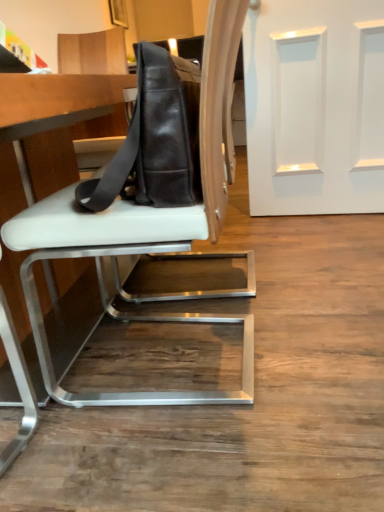
Question: In the image, is white leather table at center on the left side or the right side of white leather chair at center?

Choices:
 (A) right
 (B) left

Answer: (B)

Question: Is white leather table at center bigger or smaller than white leather chair at center?

Choices:
 (A) small
 (B) big

Answer: (B)

Question: Which object is the closest to the white smooth door at upper right?

Choices:
 (A) black leather messenger bag at center
 (B) white leather table at center
 (C) white leather chair at center

Answer: (C)

Question: Which object is the closest to the white smooth door at upper right?

Choices:
 (A) black leather messenger bag at center
 (B) white leather table at center
 (C) white leather chair at center

Answer: (C)